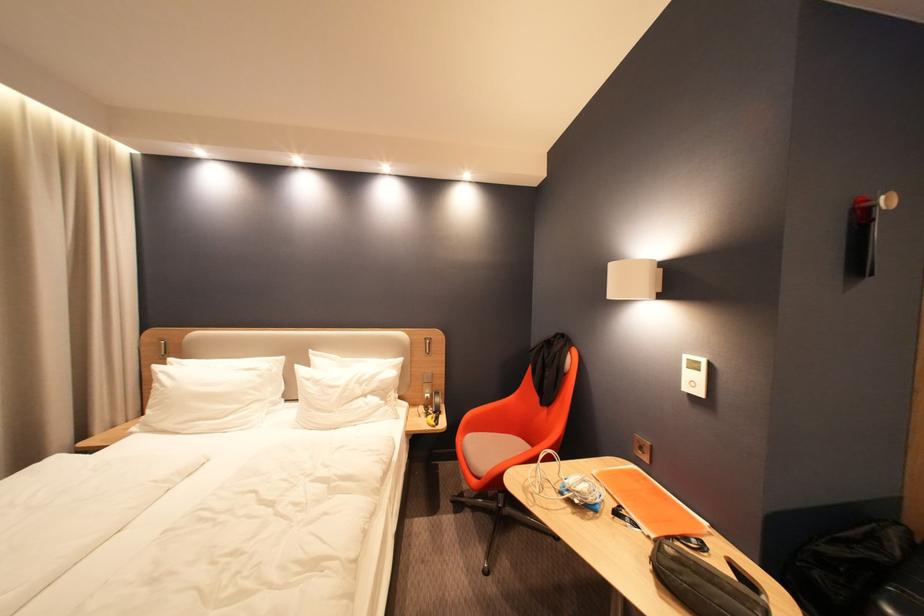
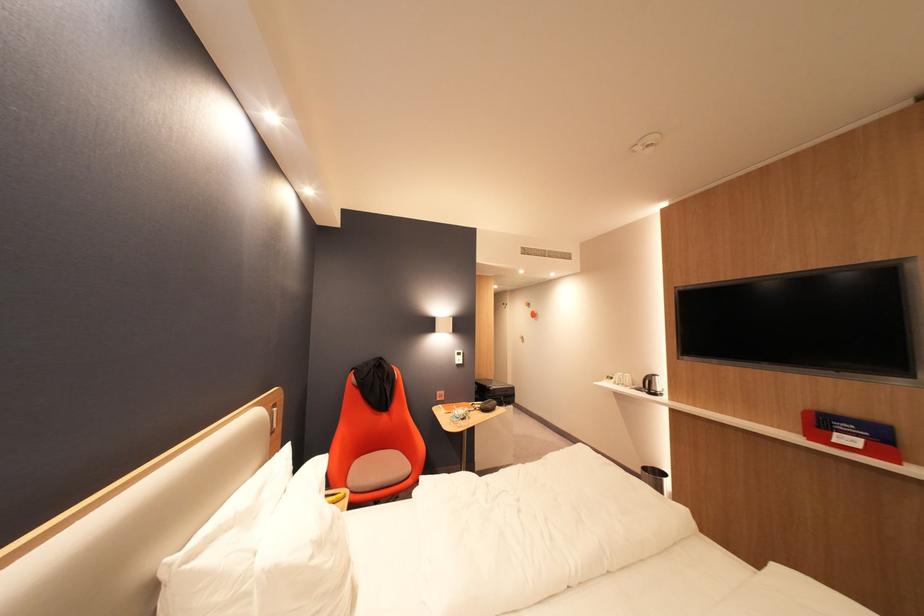
The point at [325,383] is marked in the first image. Where is the corresponding point in the second image?

(330, 545)